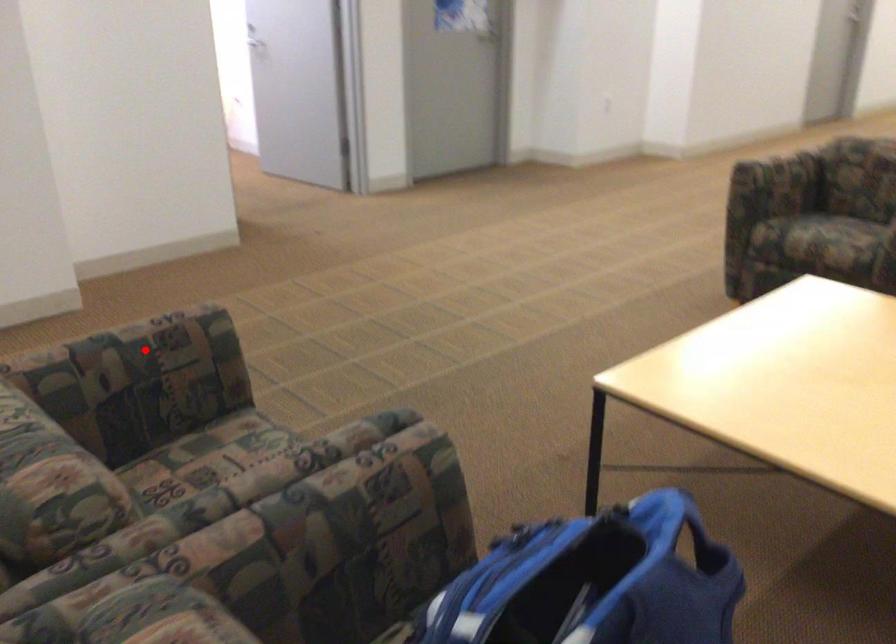
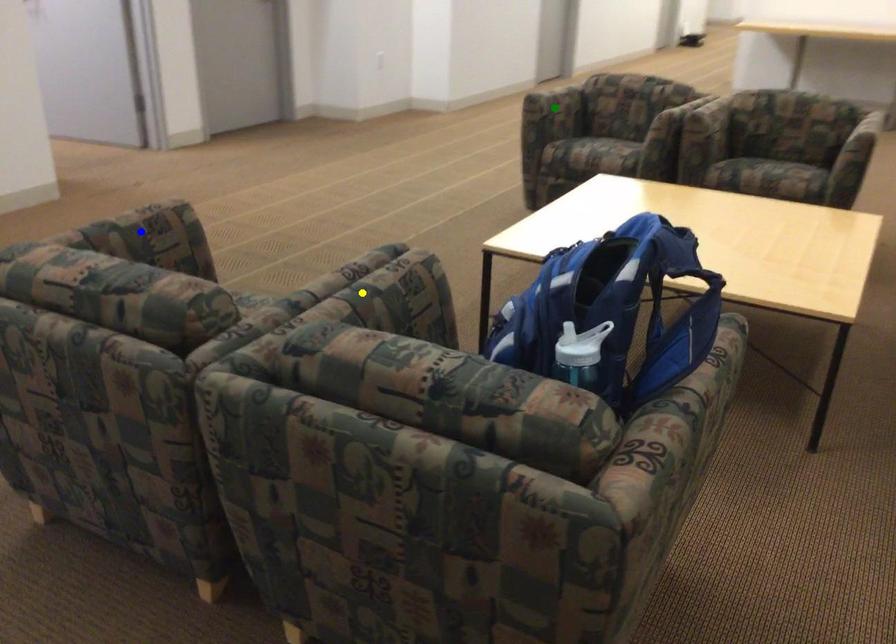
Question: I am providing you with two images of the same scene from different viewpoints. A red point is marked on the first image. You are given multiple points on the second image. In image 2, which mark is for the same physical point as the one in image 1?

Choices:
 (A) yellow point
 (B) blue point
 (C) green point

Answer: (B)